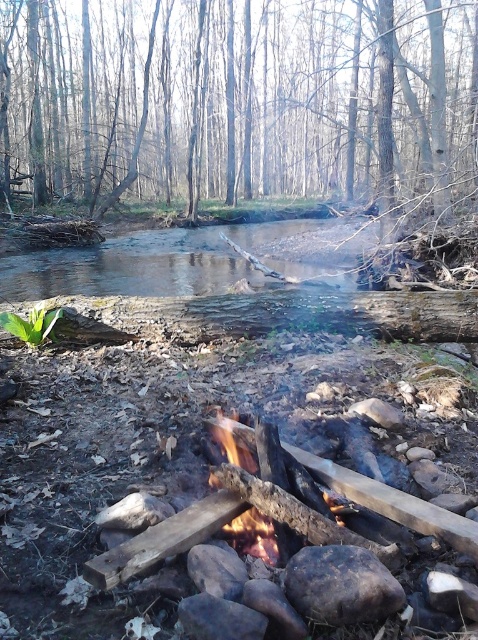
Is brown wood tree at upper center above charred wood fire at center?

Indeed, brown wood tree at upper center is positioned over charred wood fire at center.

Between brown wood tree at upper center and charred wood fire at center, which one has more height?

brown wood tree at upper center

Where is `brown wood tree at upper center`? Image resolution: width=478 pixels, height=640 pixels. brown wood tree at upper center is located at coordinates point(238,99).

Does brown wood tree at upper center have a smaller size compared to clear water at center?

Actually, brown wood tree at upper center might be larger than clear water at center.

Is point (136, 180) positioned behind point (143, 269)?

Yes, point (136, 180) is farther from viewer.

Locate an element on the screen. This screenshot has height=640, width=478. brown wood tree at upper center is located at coordinates (238, 99).

Who is higher up, clear water at center or charred wood fire at center?

clear water at center is higher up.

Can you confirm if clear water at center is positioned to the left of charred wood fire at center?

Yes, clear water at center is to the left of charred wood fire at center.

Find the location of `clear water at center`. clear water at center is located at coordinates (184, 259).

The height and width of the screenshot is (640, 478). I want to click on clear water at center, so click(x=184, y=259).